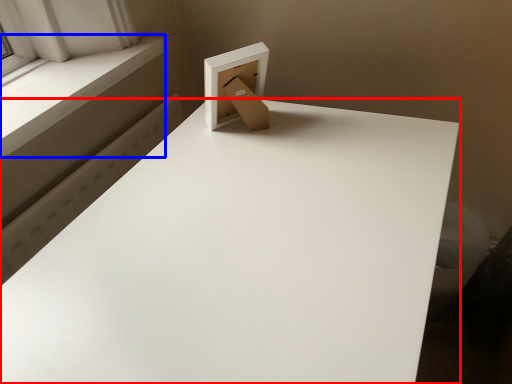
Question: Which object is further to the camera taking this photo, table (highlighted by a red box) or window sill (highlighted by a blue box)?

Choices:
 (A) table
 (B) window sill

Answer: (B)